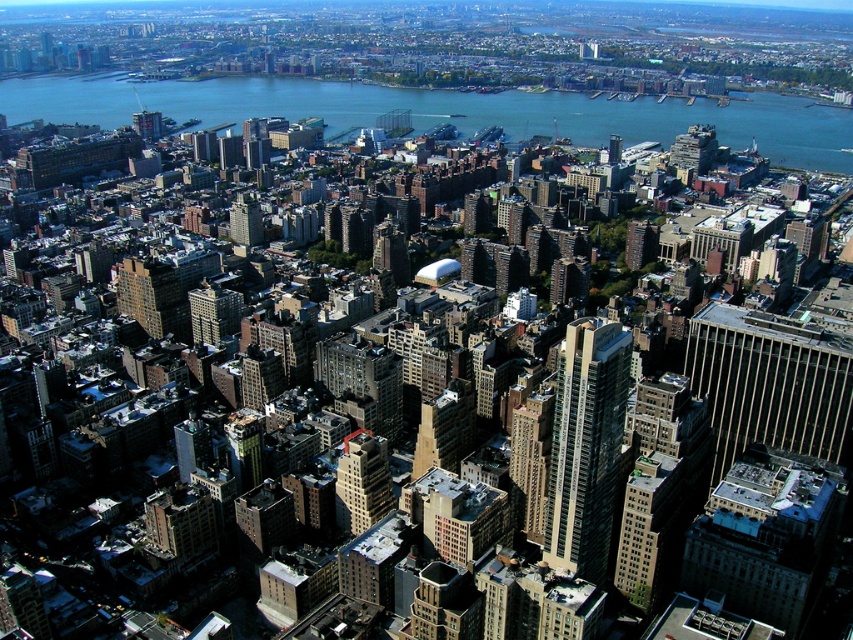
Question: Is the position of blue water at center more distant than that of brown brick building at center?

Choices:
 (A) yes
 (B) no

Answer: (A)

Question: Which point is closer to the camera?

Choices:
 (A) (236, 92)
 (B) (749, 326)

Answer: (B)

Question: Observing the image, what is the correct spatial positioning of gold glass skyscraper at right in reference to brown brick building at center?

Choices:
 (A) below
 (B) above

Answer: (B)

Question: Based on their relative distances, which object is nearer to the brown brick building at center?

Choices:
 (A) gold glass skyscraper at right
 (B) blue water at center
 (C) glassy steel skyscraper at center-right

Answer: (C)

Question: Which point is farther from the camera taking this photo?

Choices:
 (A) (621, 416)
 (B) (786, 163)
 (C) (346, 496)
 (D) (779, 349)

Answer: (B)

Question: Is glassy steel skyscraper at center-right to the left of brown brick building at center from the viewer's perspective?

Choices:
 (A) no
 (B) yes

Answer: (A)